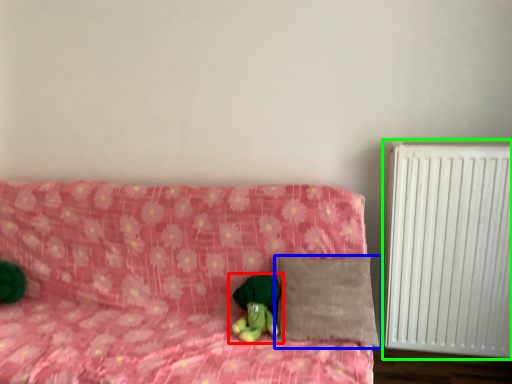
Question: Which object is the farthest from toy (highlighted by a red box)? Choose among these: pillow (highlighted by a blue box) or radiator (highlighted by a green box).

Choices:
 (A) pillow
 (B) radiator

Answer: (B)